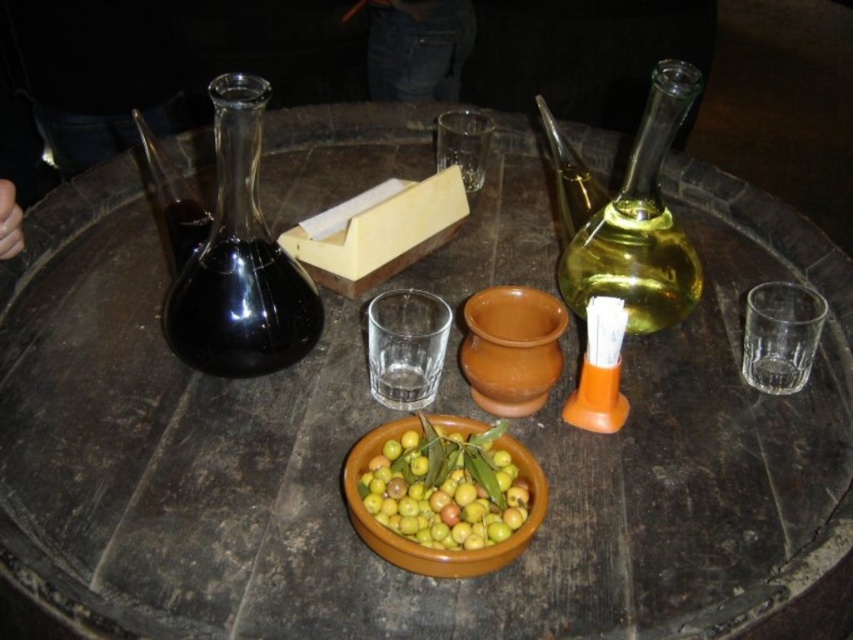
Question: Is transparent glass carafe at left in front of translucent glass carafe at upper left?

Choices:
 (A) yes
 (B) no

Answer: (A)

Question: Can you confirm if green matte bowl at center is positioned above terracotta clay bowl at center?

Choices:
 (A) no
 (B) yes

Answer: (A)

Question: Which object is closer to the camera taking this photo?

Choices:
 (A) green matte bowl at center
 (B) terracotta clay bowl at center

Answer: (A)

Question: Is green glass bottle at upper right to the left of translucent glass carafe at upper left from the viewer's perspective?

Choices:
 (A) yes
 (B) no

Answer: (B)

Question: Which of the following is the closest to the observer?

Choices:
 (A) green glass bottle at upper right
 (B) transparent glass carafe at left
 (C) terracotta clay bowl at center
 (D) green matte bowl at center

Answer: (D)

Question: Which object is positioned farthest from the green glass bottle at upper right?

Choices:
 (A) transparent glass carafe at left
 (B) green matte bowl at center

Answer: (A)